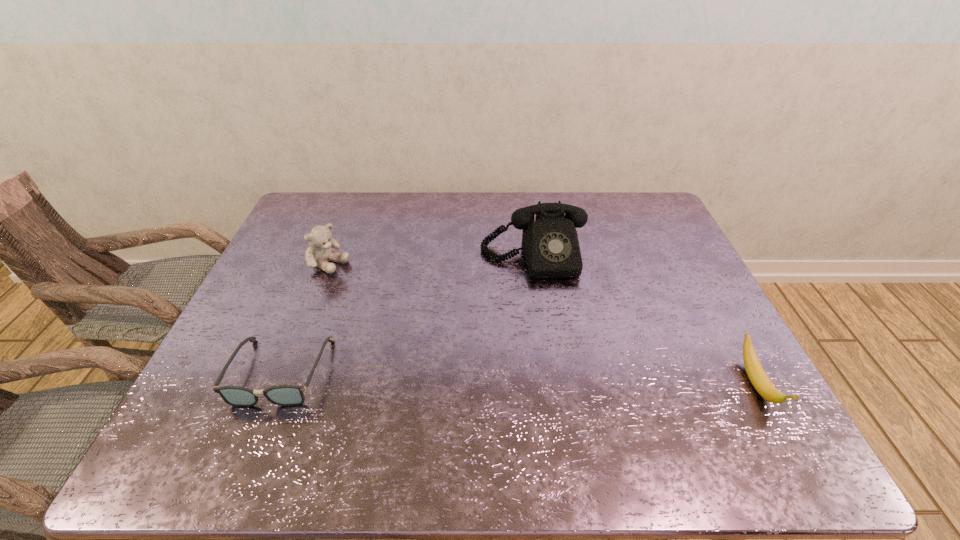
The height and width of the screenshot is (540, 960). What are the coordinates of `spectacles` in the screenshot? It's located at (284, 395).

Where is `banana`? The height and width of the screenshot is (540, 960). banana is located at coordinates (756, 374).

Find the location of a particular element. Image resolution: width=960 pixels, height=540 pixels. the rightmost object is located at coordinates (756, 374).

Where is `telephone`? telephone is located at coordinates (550, 244).

At what (x,y) coordinates should I click in order to perform the action: click on teddy bear. Please return your answer as a coordinate pair (x, y). The image size is (960, 540). Looking at the image, I should click on (319, 252).

Where is `vacant space located 0.190m on the dial of the third object from left to right`? vacant space located 0.190m on the dial of the third object from left to right is located at coordinates (551, 331).

Where is `vacant point located on the dial of the third object from left to right`? This screenshot has height=540, width=960. vacant point located on the dial of the third object from left to right is located at coordinates (546, 309).

What are the coordinates of `vacant space located on the dial of the third object from left to right` in the screenshot? It's located at (553, 343).

You are a GUI agent. You are given a task and a screenshot of the screen. Output one action in this format:
    pyautogui.click(x=<x>, y=<y>)
    Task: Click on the vacant space positioned on the face of the teddy bear
    This screenshot has width=960, height=540.
    Given the screenshot: What is the action you would take?
    pyautogui.click(x=361, y=280)

Where is `vacant space located on the face of the teddy bear`? The height and width of the screenshot is (540, 960). vacant space located on the face of the teddy bear is located at coordinates (366, 283).